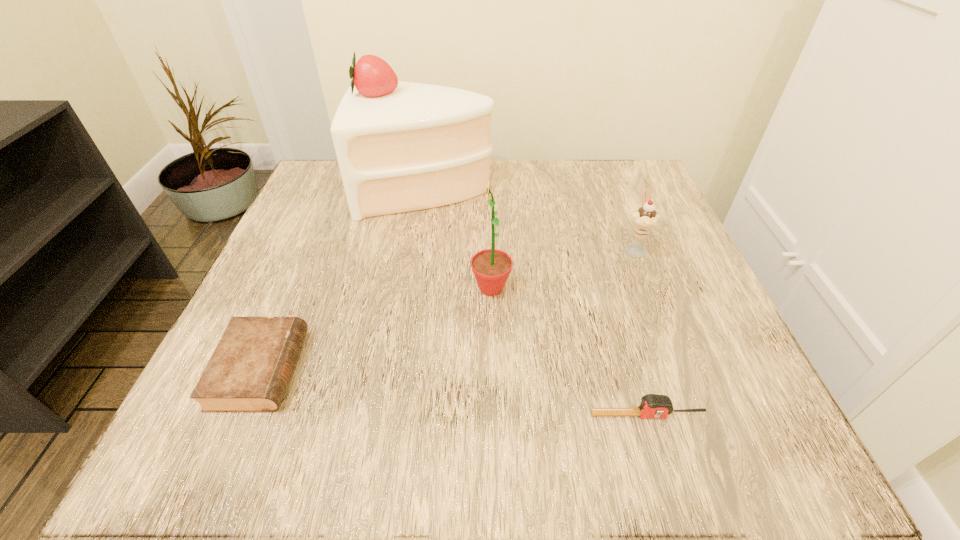
The height and width of the screenshot is (540, 960). What are the coordinates of `vacant space that satisfies the following two spatial constraints: 1. on the spine side of the leftmost object; 2. on the left side of the tape measure` in the screenshot? It's located at (241, 415).